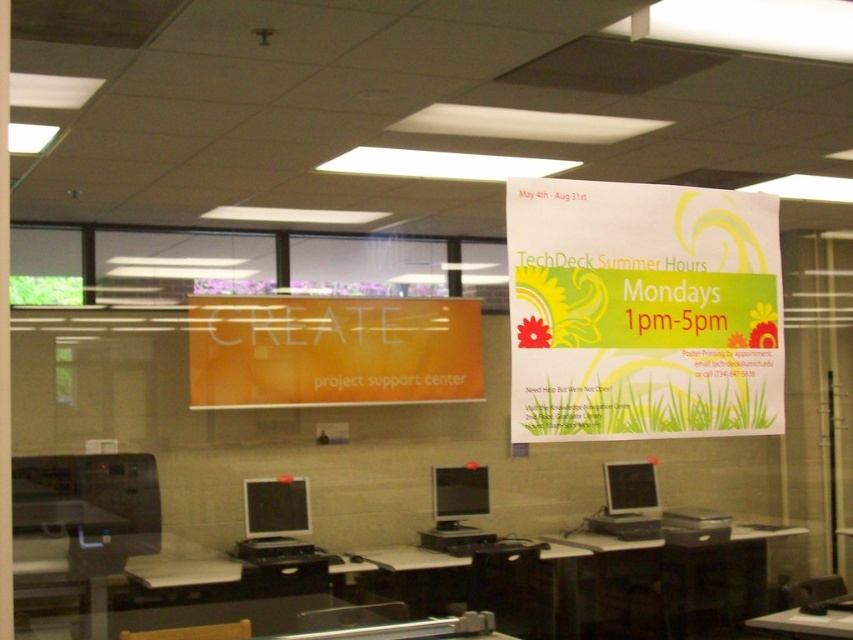
Question: Which point is closer to the camera?

Choices:
 (A) orange glossy sign at center
 (B) matte black monitor at center

Answer: (A)

Question: Which is farther from the white paper poster at upper center?

Choices:
 (A) orange glossy sign at center
 (B) wooden desk at center
 (C) matte black monitor at lower left
 (D) matte black monitor at center

Answer: (D)

Question: Is white paper poster at upper center wider than matte black monitor at center?

Choices:
 (A) yes
 (B) no

Answer: (A)

Question: Which point appears closest to the camera in this image?

Choices:
 (A) (662, 349)
 (B) (440, 330)
 (C) (465, 480)

Answer: (A)

Question: Is orange glossy sign at center to the right of matte black monitor at lower left from the viewer's perspective?

Choices:
 (A) no
 (B) yes

Answer: (B)

Question: Is white paper poster at upper center further to camera compared to orange glossy sign at center?

Choices:
 (A) no
 (B) yes

Answer: (A)